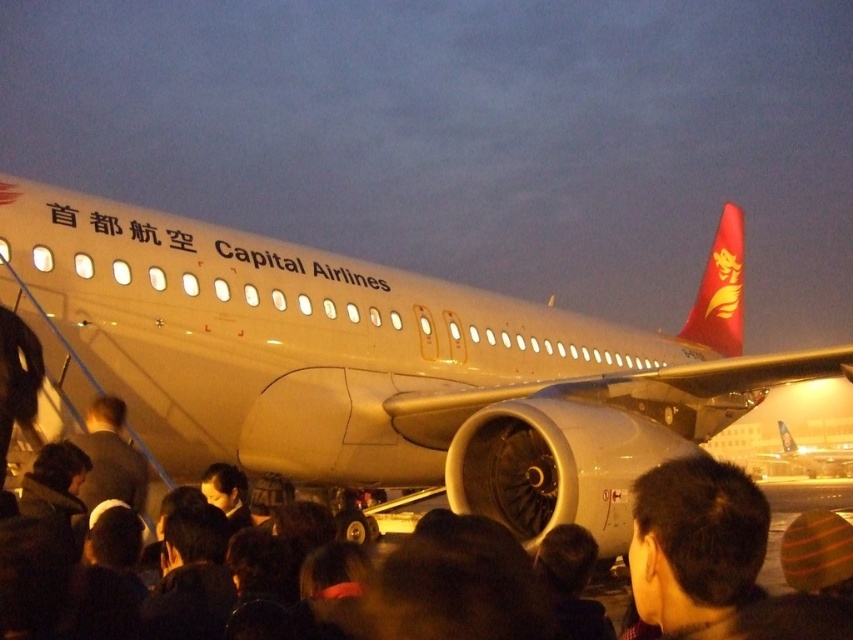
Question: Which object is positioned closest to the white matte airplane at center?

Choices:
 (A) matte white airplane at center
 (B) black matte crowd at lower center

Answer: (B)

Question: Which point is closer to the camera taking this photo?

Choices:
 (A) (843, 458)
 (B) (115, 364)

Answer: (B)

Question: Can you confirm if white matte airplane at center is bigger than black matte crowd at lower center?

Choices:
 (A) yes
 (B) no

Answer: (B)

Question: Is white matte airplane at center above black matte crowd at lower center?

Choices:
 (A) yes
 (B) no

Answer: (A)

Question: Which object appears closest to the camera in this image?

Choices:
 (A) black matte crowd at lower center
 (B) white matte airplane at center

Answer: (A)

Question: Does black matte crowd at lower center have a greater width compared to matte white airplane at center?

Choices:
 (A) yes
 (B) no

Answer: (A)